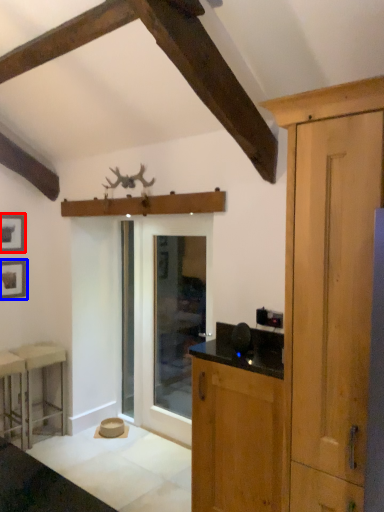
Question: Which point is closer to the camera, picture frame (highlighted by a red box) or picture frame (highlighted by a blue box)?

Choices:
 (A) picture frame
 (B) picture frame

Answer: (A)